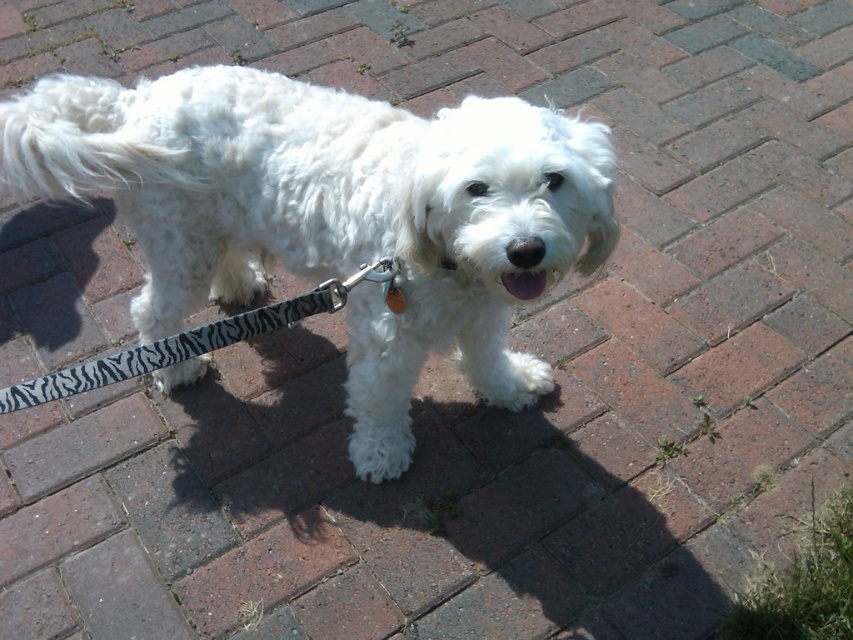
Can you confirm if white fluffy dog at center is positioned above zebra-patterned fabric leash at lower center?

Yes, white fluffy dog at center is above zebra-patterned fabric leash at lower center.

Is white fluffy dog at center to the right of zebra-patterned fabric leash at lower center from the viewer's perspective?

Indeed, white fluffy dog at center is positioned on the right side of zebra-patterned fabric leash at lower center.

Is point (456, 326) farther from camera compared to point (392, 284)?

Yes, point (456, 326) is behind point (392, 284).

Find the location of a particular element. This screenshot has width=853, height=640. white fluffy dog at center is located at coordinates (332, 214).